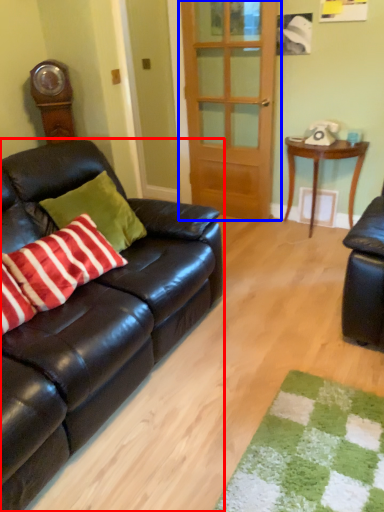
Question: Which object is further to the camera taking this photo, studio couch (highlighted by a red box) or door (highlighted by a blue box)?

Choices:
 (A) studio couch
 (B) door

Answer: (B)